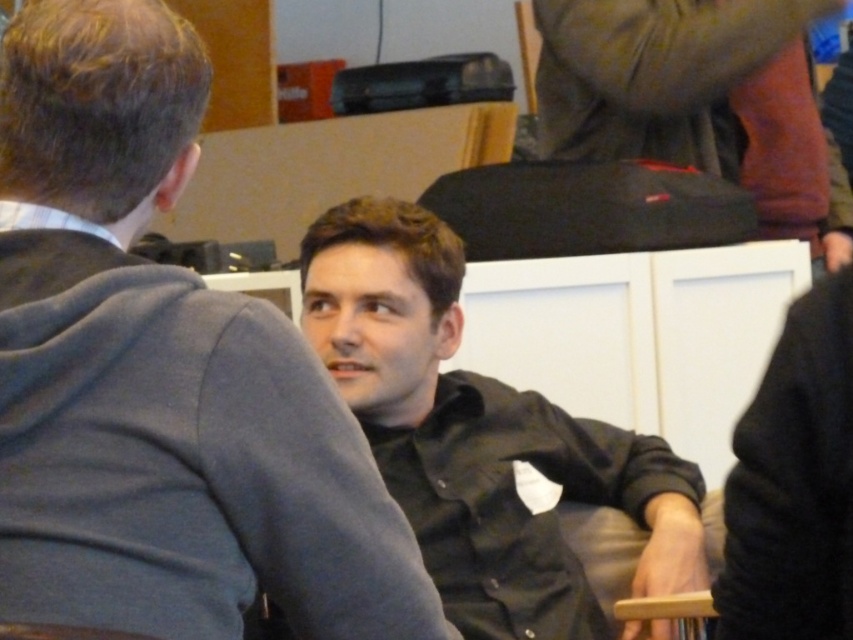
You are a photographer setting up for a group photo. You have a camera with a focus range of 35 inches. You need to capture both the black matte shirt at center and the dark gray fabric pants at upper right in focus. Can you do this with your current camera settings?

The black matte shirt at center is 37.16 inches from dark gray fabric pants at upper right. Since the distance between them is greater than the camera focus range of 35 inches, the camera cannot keep both in focus simultaneously with the current settings.

Please look at the image and tell me the exact coordinates of the black shirt at center in the 2D space. The coordinate system is normalized between 0 and 1, with the origin at the bottom left corner of the image. The first number is the x coordinate and the second is the y coordinate. Please provide your answer in the format of a point like this example format for clarity, such as point 0.5, 0.5. Please do not add any other information besides the point coordinates in your answer.

point (161,376)

In the scene shown: You are organizing a photo shoot and need to adjust the distance between the black shirt at center and the black matte shirt at center to ensure they are exactly 30 inches apart. Currently, they are 28.38 inches apart. How much more space should you add between them?

The black shirt at center and black matte shirt at center are currently 28.38 inches apart. To reach the desired 30 inches, you need to add an additional 1.62 inches between them.